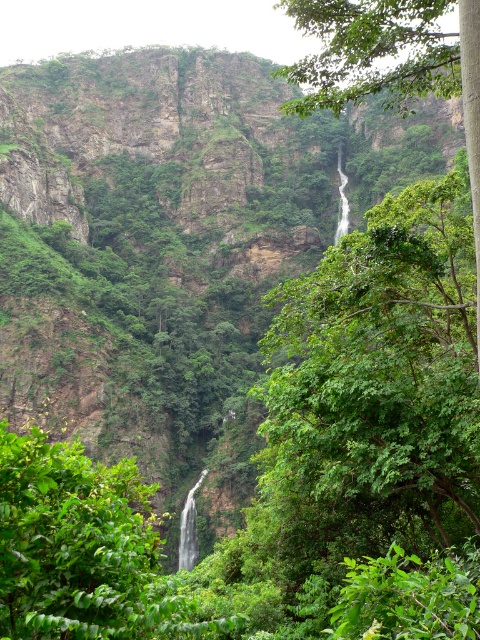
Between green leafy tree at upper center and white smooth waterfall at center, which one is positioned higher?

green leafy tree at upper center is above.

Is green leafy tree at upper center taller than white smooth waterfall at center?

Correct, green leafy tree at upper center is much taller as white smooth waterfall at center.

Which is behind, point (454, 68) or point (195, 486)?

The point (195, 486) is more distant.

What are the coordinates of `green leafy tree at upper center` in the screenshot? It's located at (372, 52).